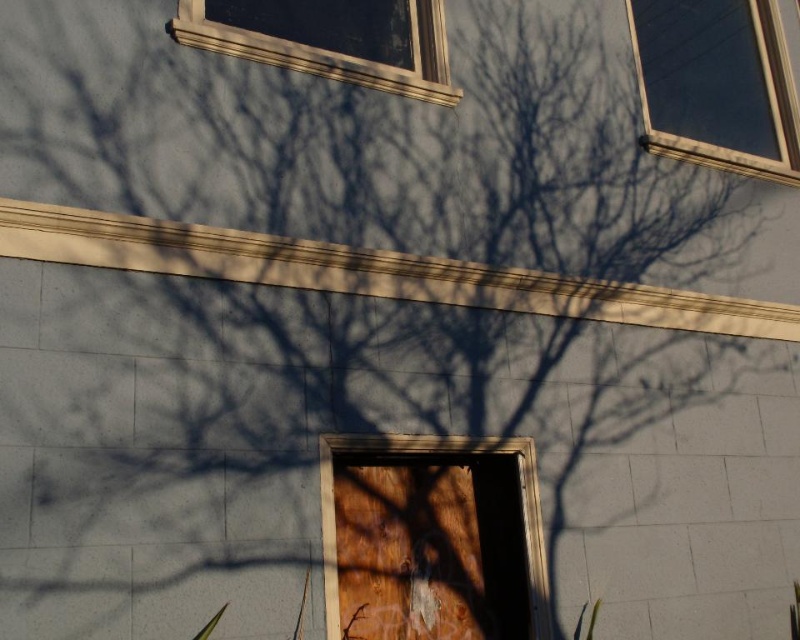
Question: Observing the image, what is the correct spatial positioning of clear glass window at upper center in reference to wooden door at center?

Choices:
 (A) right
 (B) left

Answer: (B)

Question: Which point appears farthest from the camera in this image?

Choices:
 (A) (436, 10)
 (B) (436, 442)

Answer: (A)

Question: Which of the following is the closest to the observer?

Choices:
 (A) (430, 38)
 (B) (533, 522)
 (C) (798, 150)

Answer: (B)

Question: Can you confirm if clear glass window at upper center is wider than wooden door at center?

Choices:
 (A) no
 (B) yes

Answer: (B)

Question: Is clear glass window at upper center positioned behind wooden door at center?

Choices:
 (A) no
 (B) yes

Answer: (B)

Question: Among these points, which one is nearest to the camera?

Choices:
 (A) (704, 3)
 (B) (536, 627)
 (C) (413, 51)

Answer: (B)